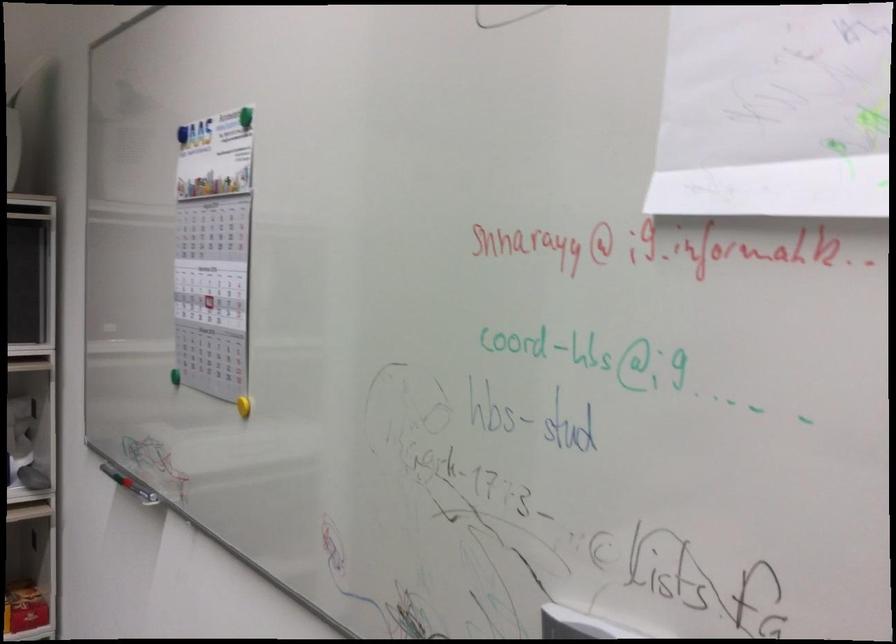
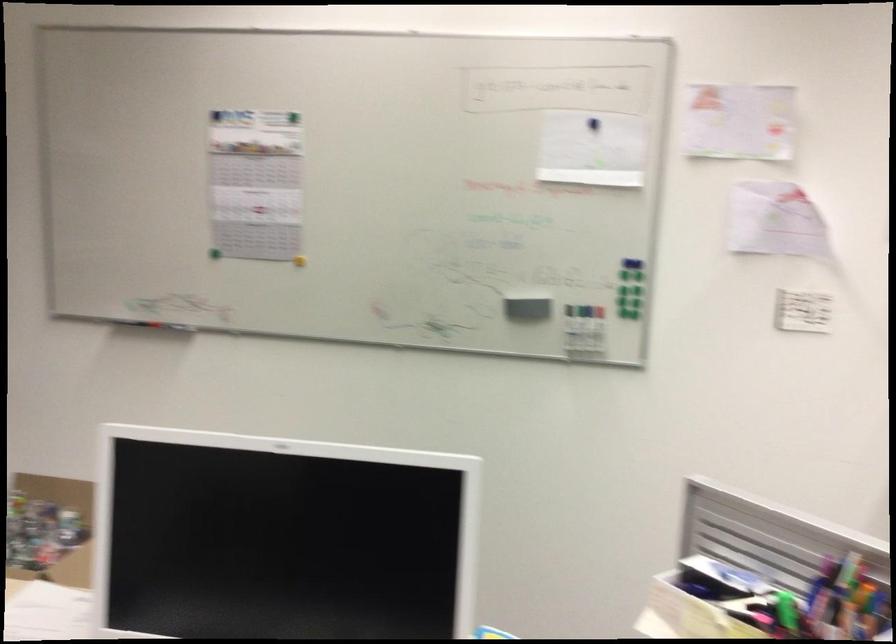
The point at (188,142) is marked in the first image. Where is the corresponding point in the second image?

(216, 116)